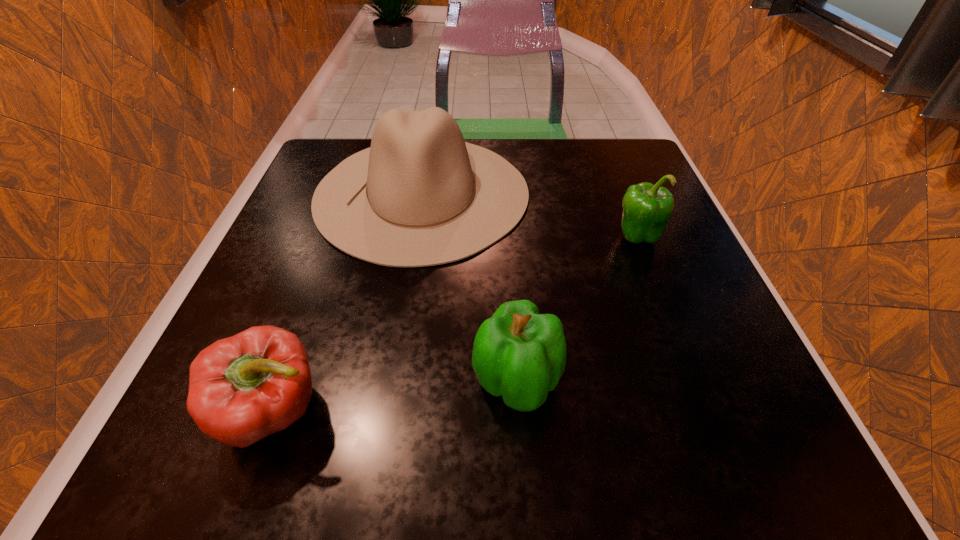
You are a GUI agent. You are given a task and a screenshot of the screen. Output one action in this format:
    pyautogui.click(x=<x>, y=<y>)
    Task: Click on the sombrero
    The width and height of the screenshot is (960, 540).
    Given the screenshot: What is the action you would take?
    pyautogui.click(x=420, y=196)

At what (x,y) coordinates should I click in order to perform the action: click on the rightmost object. Please return your answer as a coordinate pair (x, y). The width and height of the screenshot is (960, 540). Looking at the image, I should click on (647, 208).

The height and width of the screenshot is (540, 960). In order to click on the farthest bell pepper in this screenshot , I will do `click(647, 208)`.

You are a GUI agent. You are given a task and a screenshot of the screen. Output one action in this format:
    pyautogui.click(x=<x>, y=<y>)
    Task: Click on the second bell pepper from right to left
    Image resolution: width=960 pixels, height=540 pixels.
    Given the screenshot: What is the action you would take?
    pyautogui.click(x=519, y=354)

Identify the location of the leftmost bell pepper. (243, 388).

The image size is (960, 540). What are the coordinates of `vacant space located on the right of the sombrero` in the screenshot? It's located at (647, 193).

Locate an element on the screen. free space located on the left of the rightmost bell pepper is located at coordinates (582, 237).

You are a GUI agent. You are given a task and a screenshot of the screen. Output one action in this format:
    pyautogui.click(x=<x>, y=<y>)
    Task: Click on the vacant space located 0.360m on the back of the second bell pepper from left to right
    
    Given the screenshot: What is the action you would take?
    pyautogui.click(x=505, y=207)

The height and width of the screenshot is (540, 960). I want to click on vacant space located on the right of the leftmost bell pepper, so 529,412.

You are a GUI agent. You are given a task and a screenshot of the screen. Output one action in this format:
    pyautogui.click(x=<x>, y=<y>)
    Task: Click on the object positioned at the far edge
    
    Given the screenshot: What is the action you would take?
    pyautogui.click(x=420, y=196)